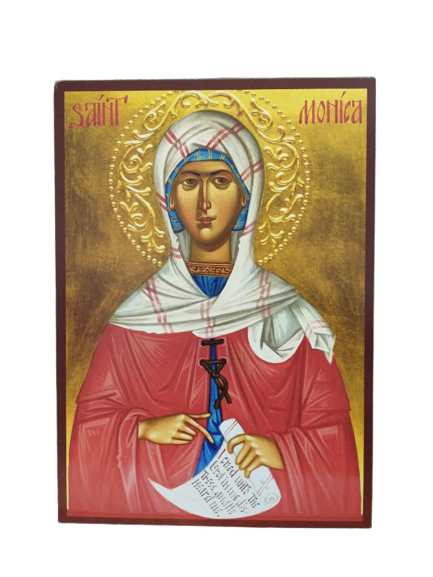
You are a GUI agent. You are given a task and a screenshot of the screen. Output one action in this format:
    pyautogui.click(x=<x>, y=<y>)
    Task: Click on the blue textiles
    
    Given the screenshot: What is the action you would take?
    pyautogui.click(x=212, y=427), pyautogui.click(x=205, y=280), pyautogui.click(x=202, y=155)